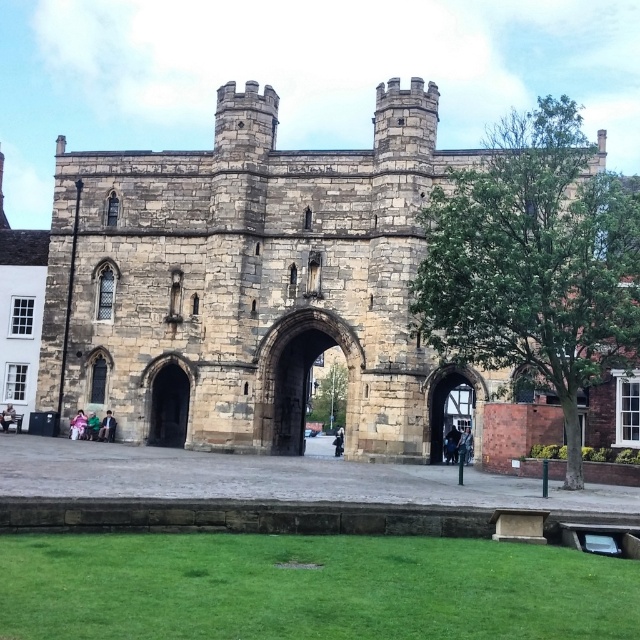
Question: Which object appears farthest from the camera in this image?

Choices:
 (A) light pink fabric at lower left
 (B) green fabric jacket at lower left
 (C) dark green fabric jacket at center

Answer: (A)

Question: Does dark stone archway at center have a lesser width compared to wooden gate at center?

Choices:
 (A) no
 (B) yes

Answer: (B)

Question: Which point is closer to the camera?

Choices:
 (A) wooden gate at center
 (B) light pink fabric at lower left

Answer: (A)

Question: Which is nearer to the light pink fabric at lower left?

Choices:
 (A) dark blue jeans at center
 (B) dark stone archway at center
 (C) dark gray stone person at center

Answer: (B)

Question: Can you confirm if stone castle at center is positioned above dark blue jeans at center?

Choices:
 (A) no
 (B) yes

Answer: (B)

Question: Is dark stone archway at center positioned before light brown leather jacket at lower left?

Choices:
 (A) no
 (B) yes

Answer: (B)